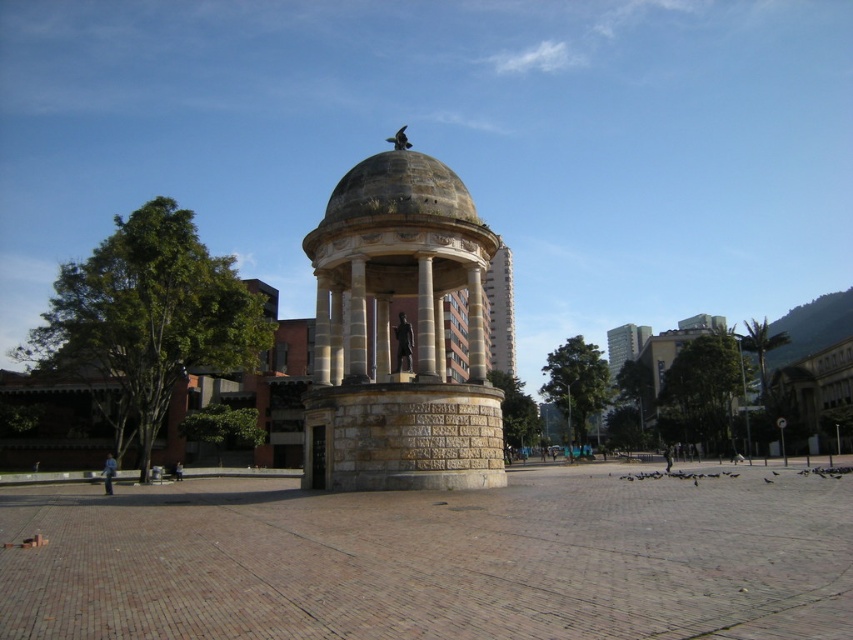
Between stone gazebo at center and smooth concrete tower at center, which one is positioned higher?

stone gazebo at center is higher up.

Is stone gazebo at center taller than smooth concrete tower at center?

In fact, stone gazebo at center may be shorter than smooth concrete tower at center.

You are a GUI agent. You are given a task and a screenshot of the screen. Output one action in this format:
    pyautogui.click(x=<x>, y=<y>)
    Task: Click on the stone gazebo at center
    
    Given the screenshot: What is the action you would take?
    pyautogui.click(x=387, y=333)